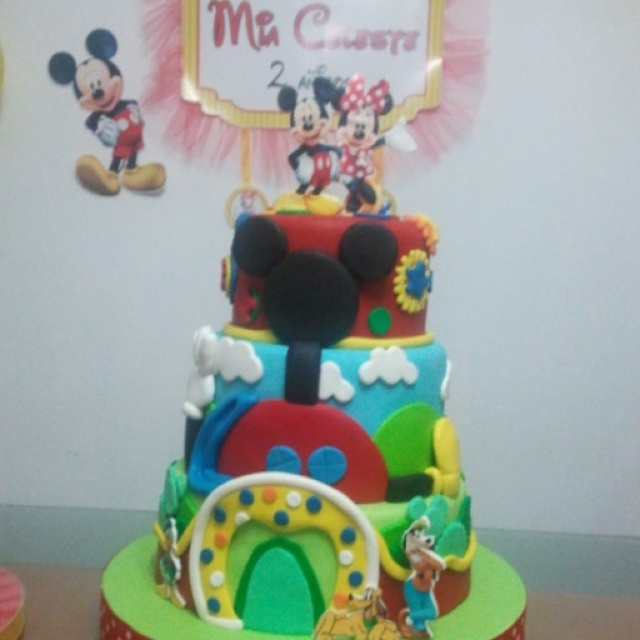
You are a guest at a birthday party and want to take a photo of the smooth fondant cake at center and the smooth plastic mickey mouse at center. Which one should you focus on first to ensure both are in the frame?

You should focus on the smooth fondant cake at center first since it is closer to you, and then adjust to include the smooth plastic mickey mouse at center which is further away.

You are a guest at a birthday party and want to take a photo of the cake. You notice the matte red plush toy at upper left and the smooth plastic mickey mouse at center. Which one will appear closer to you in the photo?

The matte red plush toy at upper left will appear closer to you in the photo because it is positioned further to the viewer than the smooth plastic mickey mouse at center.

You are a guest at a birthday party where the cake is placed on a round table. You want to place a matte red plush toy at upper left on the table without blocking the view of the smooth fondant cake at center. Is this possible?

The smooth fondant cake at center is in front of the matte red plush toy at upper left, so placing the matte red plush toy at upper left on the table would block the view of the smooth fondant cake at center. Therefore, it is not possible to place the matte red plush toy at upper left without blocking the view.